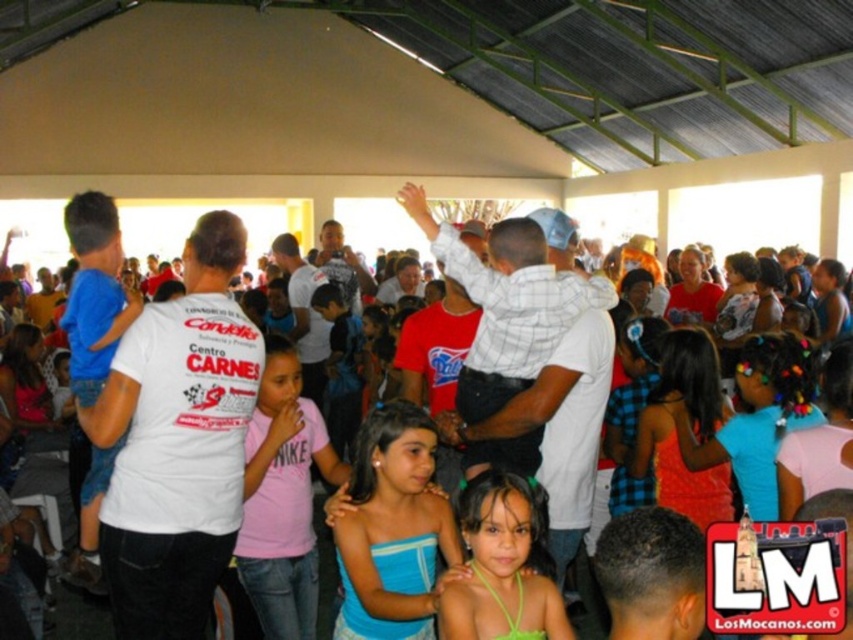
Question: Which object is the farthest from the blue fabric dress at center?

Choices:
 (A) white cotton shirt at center
 (B) pink cotton shirt at center
 (C) green fabric dress at center

Answer: (A)

Question: Among these objects, which one is farthest from the camera?

Choices:
 (A) pink cotton shirt at center
 (B) green fabric dress at center
 (C) white cotton shirt at center

Answer: (C)

Question: Which object is farther from the camera taking this photo?

Choices:
 (A) pink cotton shirt at center
 (B) blue fabric dress at center
 (C) green fabric dress at center

Answer: (A)

Question: Does green fabric dress at center appear over white cotton shirt at center?

Choices:
 (A) no
 (B) yes

Answer: (B)

Question: Considering the relative positions of green fabric dress at center and white cotton shirt at center in the image provided, where is green fabric dress at center located with respect to white cotton shirt at center?

Choices:
 (A) above
 (B) below

Answer: (A)

Question: Can you confirm if pink cotton shirt at center is bigger than green fabric dress at center?

Choices:
 (A) no
 (B) yes

Answer: (B)